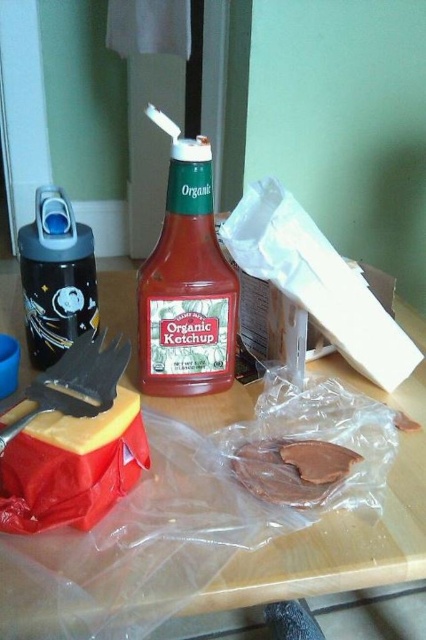
Could you measure the distance between matte glass bottle of organic ketchup at center and brown matte chocolate at center?

A distance of 6.79 inches exists between matte glass bottle of organic ketchup at center and brown matte chocolate at center.

The image size is (426, 640). Describe the element at coordinates (187, 288) in the screenshot. I see `matte glass bottle of organic ketchup at center` at that location.

I want to click on matte glass bottle of organic ketchup at center, so click(x=187, y=288).

Is brown matte chocolate at center taller than yellow cheese at lower left?

No.

Is point (276, 474) behind point (123, 397)?

Yes, it is.

Where is `brown matte chocolate at center`? This screenshot has width=426, height=640. brown matte chocolate at center is located at coordinates (291, 468).

Locate an element on the screen. brown matte chocolate at center is located at coordinates (291, 468).

Locate an element on the screen. matte glass bottle of organic ketchup at center is located at coordinates (187, 288).

Does matte glass bottle of organic ketchup at center have a greater width compared to yellow cheese at lower left?

Indeed, matte glass bottle of organic ketchup at center has a greater width compared to yellow cheese at lower left.

Is point (181, 211) more distant than point (31, 424)?

Yes.

Where is `matte glass bottle of organic ketchup at center`? matte glass bottle of organic ketchup at center is located at coordinates (187, 288).